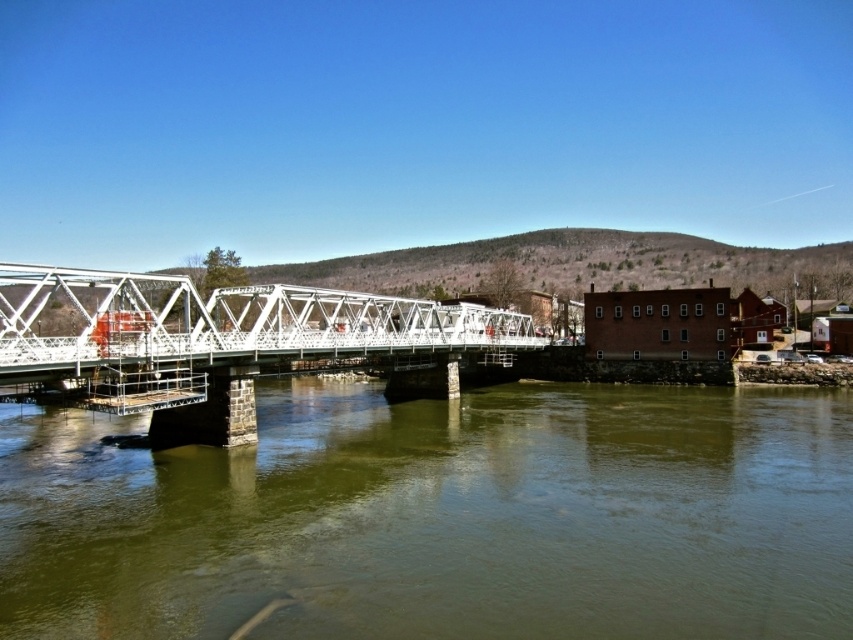
Question: Does green murky water at center appear on the left side of white metallic bridge at center?

Choices:
 (A) no
 (B) yes

Answer: (A)

Question: From the image, what is the correct spatial relationship of green murky water at center in relation to white metallic bridge at center?

Choices:
 (A) right
 (B) left

Answer: (A)

Question: Does green murky water at center have a lesser width compared to white metallic bridge at center?

Choices:
 (A) no
 (B) yes

Answer: (A)

Question: Which of the following is the closest to the observer?

Choices:
 (A) green murky water at center
 (B) white metallic bridge at center

Answer: (A)

Question: Which object appears closest to the camera in this image?

Choices:
 (A) green murky water at center
 (B) white metallic bridge at center

Answer: (A)

Question: Which point appears farthest from the camera in this image?

Choices:
 (A) (177, 401)
 (B) (718, 500)

Answer: (A)